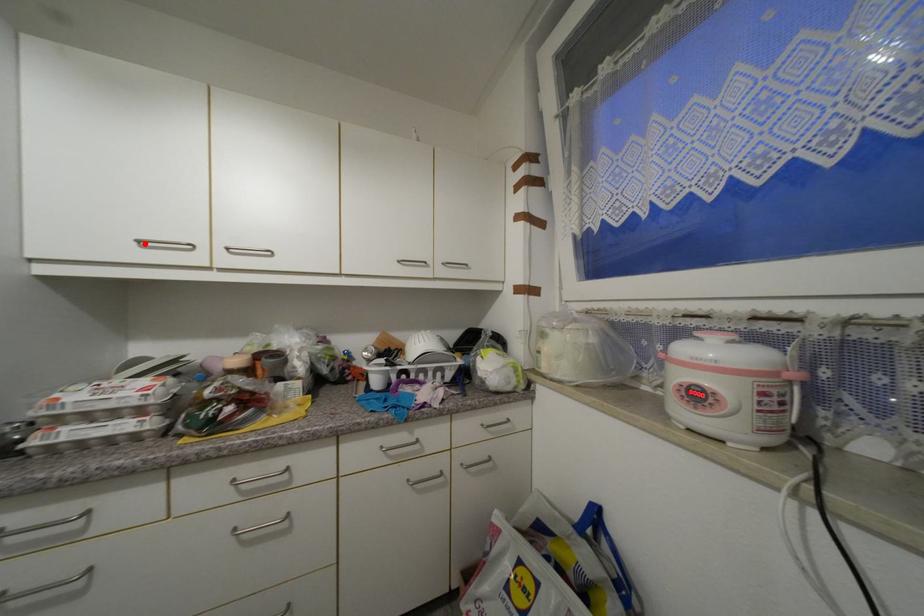
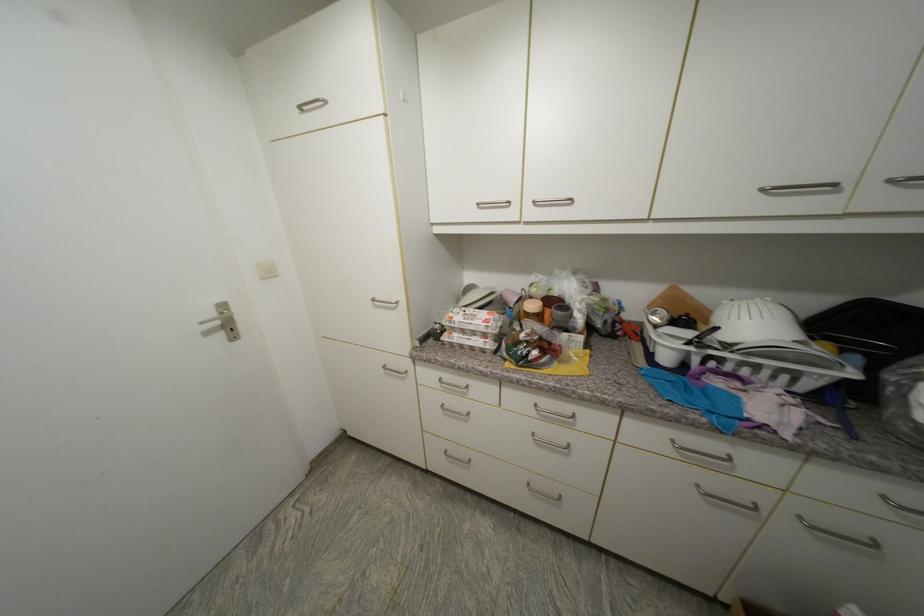
Locate, in the second image, the point that corresponds to the highlighted location in the first image.

(483, 206)